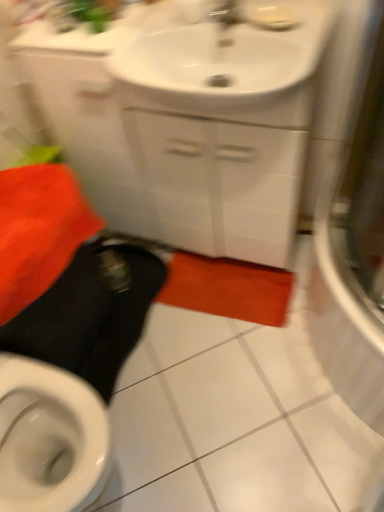
You are a GUI agent. You are given a task and a screenshot of the screen. Output one action in this format:
    pyautogui.click(x=<x>, y=<y>)
    Task: Click on the transparent glass shower door at right
    
    Given the screenshot: What is the action you would take?
    pyautogui.click(x=354, y=251)

Which is nearer, [216,60] or [114,159]?

The point [216,60] is in front.

Which object is thinner, white glossy sink at upper center or white glossy cabinet at upper center?

white glossy cabinet at upper center.

In terms of height, does white glossy sink at upper center look taller or shorter compared to white glossy cabinet at upper center?

Considering their sizes, white glossy sink at upper center has less height than white glossy cabinet at upper center.

Does white glossy sink at upper center turn towards white glossy cabinet at upper center?

Yes, white glossy sink at upper center is aimed at white glossy cabinet at upper center.

From the picture: Between white glossy cabinet at upper center and white glossy sink at upper center, which one has smaller width?

white glossy cabinet at upper center.

Does point (253, 216) lie in front of point (194, 53)?

No, (253, 216) is behind (194, 53).

At what (x,y) coordinates should I click in order to perform the action: click on cabinetry directly beneath the white glossy sink at upper center (from a real-world perspective). Please return your answer as a coordinate pair (x, y). Looking at the image, I should click on (180, 161).

Looking at the image, does white glossy cabinet at upper center seem bigger or smaller compared to white glossy sink at upper center?

In the image, white glossy cabinet at upper center appears to be larger than white glossy sink at upper center.

Between black rubber squat at lower left and white glossy cabinet at upper center, which one has smaller width?

→ Thinner between the two is white glossy cabinet at upper center.

Is black rubber squat at lower left far away from white glossy cabinet at upper center?

No, black rubber squat at lower left is not far away from white glossy cabinet at upper center.

In the scene shown: Could you tell me if black rubber squat at lower left is turned towards white glossy cabinet at upper center?

No, black rubber squat at lower left is not turned towards white glossy cabinet at upper center.

From a real-world perspective, is black rubber squat at lower left located higher than white glossy cabinet at upper center?

No, from a real-world perspective, black rubber squat at lower left is not above white glossy cabinet at upper center.

In the scene shown: Is black rubber squat at lower left closer to camera compared to transparent glass shower door at right?

Yes, it is in front of transparent glass shower door at right.

How different are the orientations of black rubber squat at lower left and transparent glass shower door at right in degrees?

The facing directions of black rubber squat at lower left and transparent glass shower door at right are 92.4 degrees apart.

Considering the positions of objects black rubber squat at lower left and transparent glass shower door at right in the image provided, who is more to the right, black rubber squat at lower left or transparent glass shower door at right?

transparent glass shower door at right is more to the right.

At what (x,y) coordinates should I click in order to perform the action: click on screen door that appears below the white glossy cabinet at upper center (from a real-world perspective). Please return your answer as a coordinate pair (x, y). The image size is (384, 512). Looking at the image, I should click on (354, 251).

Would you say transparent glass shower door at right is to the left or to the right of white glossy cabinet at upper center in the picture?

transparent glass shower door at right is to the right of white glossy cabinet at upper center.

From a real-world perspective, between transparent glass shower door at right and white glossy cabinet at upper center, who is vertically lower?

transparent glass shower door at right.

Does point (317, 31) come farther from viewer compared to point (101, 387)?

No, it is not.

The width and height of the screenshot is (384, 512). In order to click on sink on the right of black rubber squat at lower left in this screenshot , I will do `click(226, 57)`.

Measure the distance between white glossy sink at upper center and black rubber squat at lower left.

The distance of white glossy sink at upper center from black rubber squat at lower left is 28.92 inches.

Between white glossy sink at upper center and black rubber squat at lower left, which one has smaller size?

Smaller between the two is white glossy sink at upper center.

Is white glossy cabinet at upper center not within black rubber squat at lower left?

white glossy cabinet at upper center lies outside black rubber squat at lower left's area.

Would you consider white glossy cabinet at upper center to be distant from black rubber squat at lower left?

They are positioned close to each other.

Is white glossy cabinet at upper center thinner than black rubber squat at lower left?

Yes.

Visually, is white glossy cabinet at upper center positioned to the left or to the right of black rubber squat at lower left?

Clearly, white glossy cabinet at upper center is on the right of black rubber squat at lower left in the image.

Locate an element on the screen. sink above the white glossy cabinet at upper center (from a real-world perspective) is located at coordinates (226, 57).

Locate an element on the screen. The height and width of the screenshot is (512, 384). cabinetry on the left side of white glossy sink at upper center is located at coordinates (180, 161).

Which object lies nearer to the anchor point black rubber squat at lower left, white glossy cabinet at upper center or transparent glass shower door at right?

white glossy cabinet at upper center lies closer to black rubber squat at lower left than the other object.

Which object lies further to the anchor point black rubber squat at lower left, white glossy sink at upper center or white glossy cabinet at upper center?

The object further to black rubber squat at lower left is white glossy sink at upper center.

Considering their positions, is black rubber squat at lower left positioned closer to white glossy cabinet at upper center than transparent glass shower door at right?

black rubber squat at lower left is closer to white glossy cabinet at upper center.

Looking at the image, which one is located closer to transparent glass shower door at right, white glossy cabinet at upper center or white glossy sink at upper center?

white glossy sink at upper center is positioned closer to the anchor transparent glass shower door at right.

Looking at this image, when comparing their distances from transparent glass shower door at right, does white glossy cabinet at upper center or black rubber squat at lower left seem closer?

Among the two, white glossy cabinet at upper center is located nearer to transparent glass shower door at right.

Considering their positions, is white glossy sink at upper center positioned closer to transparent glass shower door at right than black rubber squat at lower left?

white glossy sink at upper center.

In the scene shown: When comparing their distances from white glossy cabinet at upper center, does transparent glass shower door at right or black rubber squat at lower left seem further?

transparent glass shower door at right lies further to white glossy cabinet at upper center than the other object.

Based on their spatial positions, is white glossy cabinet at upper center or white glossy sink at upper center further from black rubber squat at lower left?

white glossy sink at upper center is further to black rubber squat at lower left.

Where is `cabinetry located between black rubber squat at lower left and transparent glass shower door at right in the left-right direction`? cabinetry located between black rubber squat at lower left and transparent glass shower door at right in the left-right direction is located at coordinates (180, 161).

Identify the location of cabinetry between white glossy sink at upper center and transparent glass shower door at right in the up-down direction. Image resolution: width=384 pixels, height=512 pixels. (180, 161).

This screenshot has height=512, width=384. Identify the location of sink between black rubber squat at lower left and transparent glass shower door at right in the horizontal direction. (226, 57).

Identify the location of cabinetry between white glossy sink at upper center and black rubber squat at lower left in the up-down direction. (180, 161).